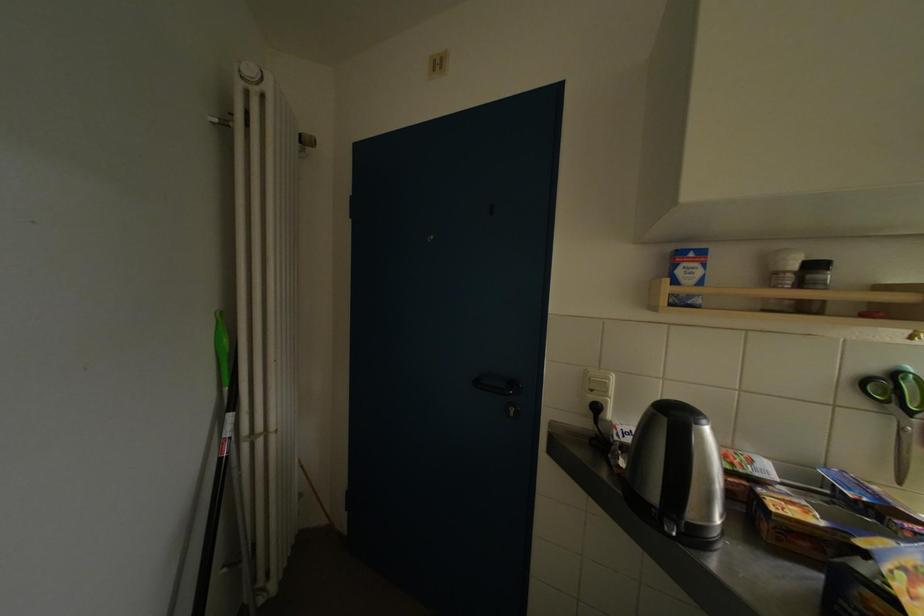
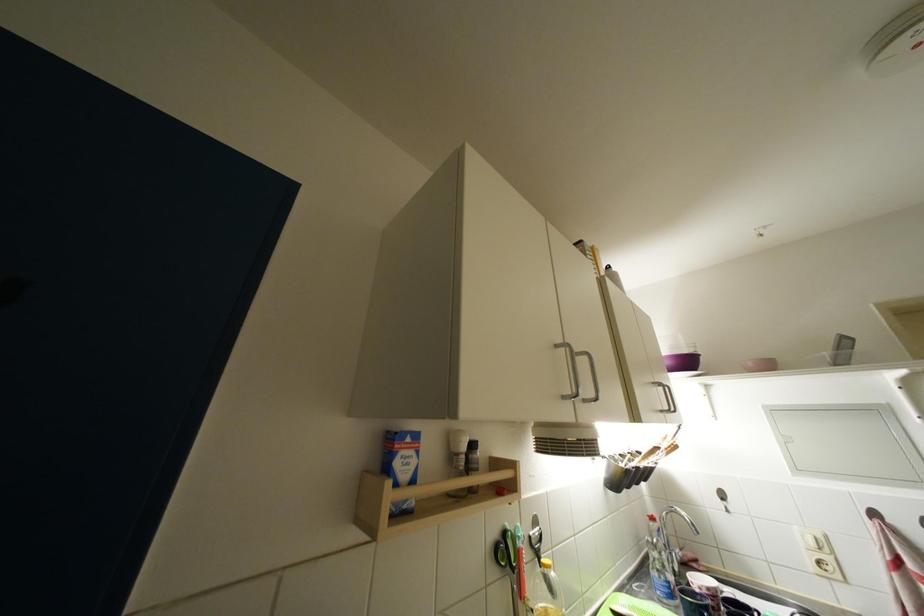
Locate, in the second image, the point that corresponds to (816,281) in the first image.

(478, 460)